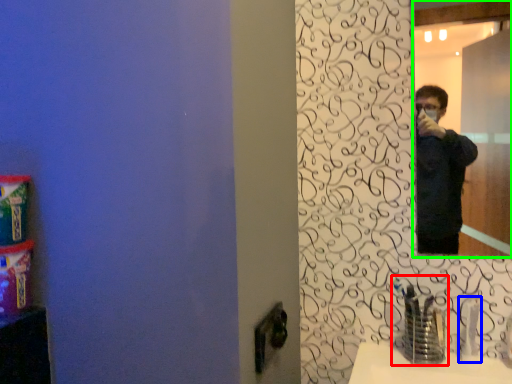
Question: Based on their relative distances, which object is farther from faucet (highlighted by a red box)? Choose from faucet (highlighted by a blue box) and mirror (highlighted by a green box).

Choices:
 (A) faucet
 (B) mirror

Answer: (B)